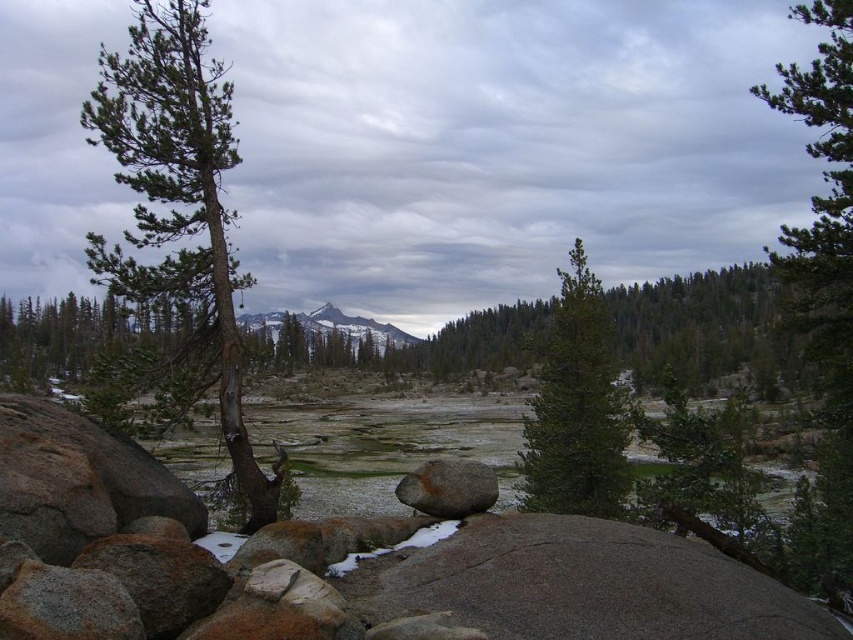
You are standing at the center of the rocky terrain in the foreground of the image. You notice a point marked at coordinates (x=576, y=408). Based on the scene description, which object does this point correspond to?

The point at coordinates (x=576, y=408) corresponds to the green matte tree at center, as stated in the Objects Description.